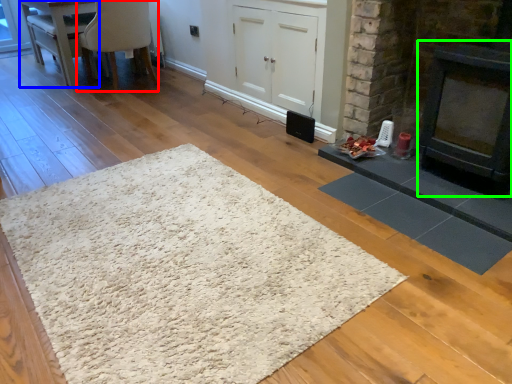
Question: Which object is positioned closest to chair (highlighted by a red box)? Select from table (highlighted by a blue box) and fireplace (highlighted by a green box).

Choices:
 (A) table
 (B) fireplace

Answer: (A)